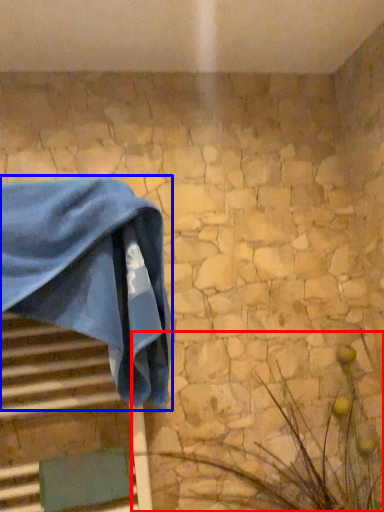
Question: Which of the following is the closest to the observer, plant (highlighted by a red box) or towel (highlighted by a blue box)?

Choices:
 (A) plant
 (B) towel

Answer: (A)